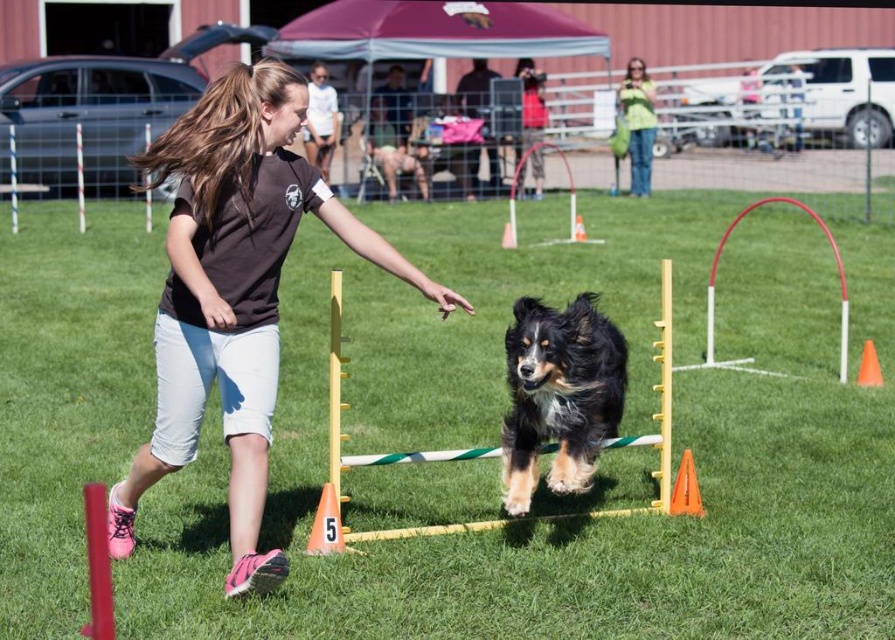
You are standing at the starting point of the dog agility course and want to reach a specific point marked at coordinates point (593, 387). If your maximum comfortable walking distance is 6 meters, can you comfortably walk to that point?

The distance of point (593, 387) from viewer is 5.62 meters, so yes, you can comfortably walk to that point since it is within your 6 meters limit.